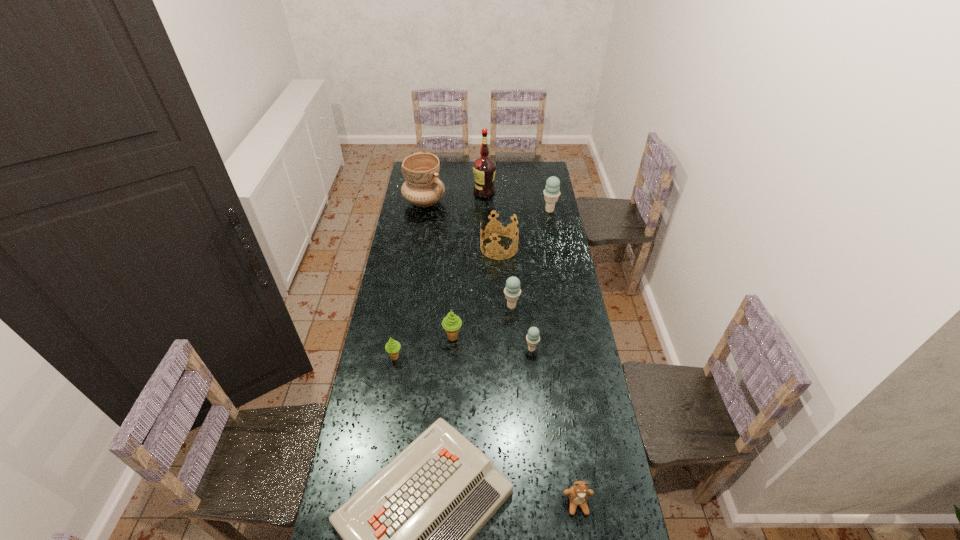
What are the coordinates of `vacant space at the left edge of the desktop` in the screenshot? It's located at (369, 431).

Find the location of `free space at the right edge`. free space at the right edge is located at coordinates (581, 347).

Identify the location of free space between the alcohol and the nearer green icecream. The width and height of the screenshot is (960, 540). (440, 275).

The width and height of the screenshot is (960, 540). I want to click on empty location between the smallest blue ice cream and the farther green icecream, so click(492, 343).

The image size is (960, 540). What are the coordinates of `empty space between the beige pottery and the third icecream from right to left` in the screenshot? It's located at (468, 254).

You are a GUI agent. You are given a task and a screenshot of the screen. Output one action in this format:
    pyautogui.click(x=<x>, y=<y>)
    Task: Click on the vacant area that lies between the teddy bear and the bigger green icecream
    This screenshot has height=540, width=960.
    Given the screenshot: What is the action you would take?
    pyautogui.click(x=516, y=421)

Identify the location of free space between the eighth shortest object and the leftmost icecream. (472, 284).

Identify the location of vacant area between the leftmost icecream and the teddy bear. The image size is (960, 540). (487, 430).

You are a GUI agent. You are given a task and a screenshot of the screen. Output one action in this format:
    pyautogui.click(x=<x>, y=<y>)
    Task: Click on the free space between the fourth icecream from left to right and the alcohol
    
    Given the screenshot: What is the action you would take?
    pyautogui.click(x=508, y=271)

Identify the location of vacant area between the second blue ice cream from left to right and the nearer green icecream. The height and width of the screenshot is (540, 960). (464, 353).